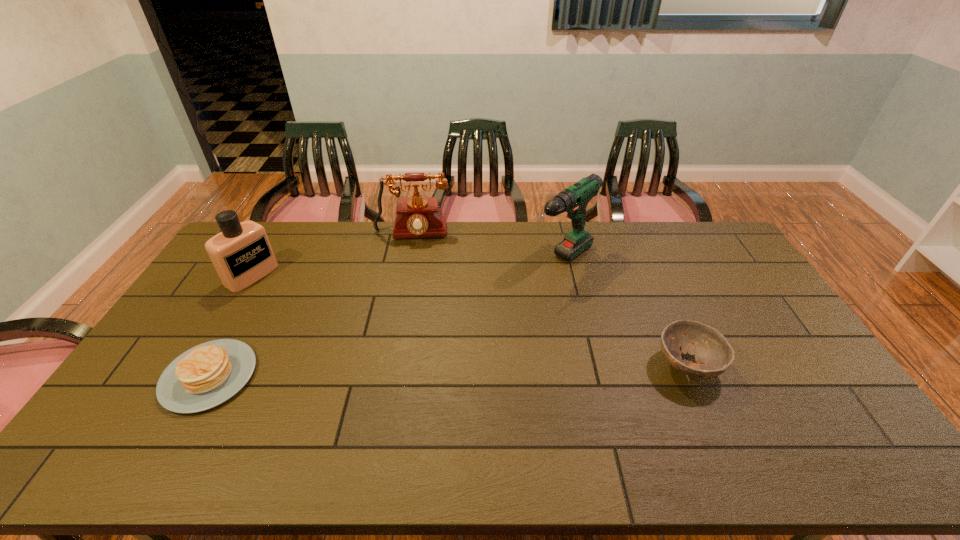
The image size is (960, 540). What are the coordinates of `object situated at the near edge` in the screenshot? It's located at (205, 376).

This screenshot has height=540, width=960. What are the coordinates of `pancake present at the left edge` in the screenshot? It's located at (205, 376).

This screenshot has height=540, width=960. I want to click on perfume that is at the left edge, so click(241, 253).

At what (x,y) coordinates should I click in order to perform the action: click on object positioned at the near left corner. Please return your answer as a coordinate pair (x, y). Looking at the image, I should click on (205, 376).

At what (x,y) coordinates should I click in order to perform the action: click on vacant point at the far edge. Please return your answer as a coordinate pair (x, y). The image size is (960, 540). Looking at the image, I should click on (481, 227).

This screenshot has width=960, height=540. I want to click on free region at the near edge of the desktop, so click(744, 407).

Locate an element on the screen. free space at the left edge of the desktop is located at coordinates (188, 321).

Where is `vacant area at the right edge`? vacant area at the right edge is located at coordinates (806, 393).

Where is `vacant space at the near left corner`? vacant space at the near left corner is located at coordinates (156, 407).

The height and width of the screenshot is (540, 960). Find the location of `vacant space at the far right corner of the desktop`. vacant space at the far right corner of the desktop is located at coordinates (687, 228).